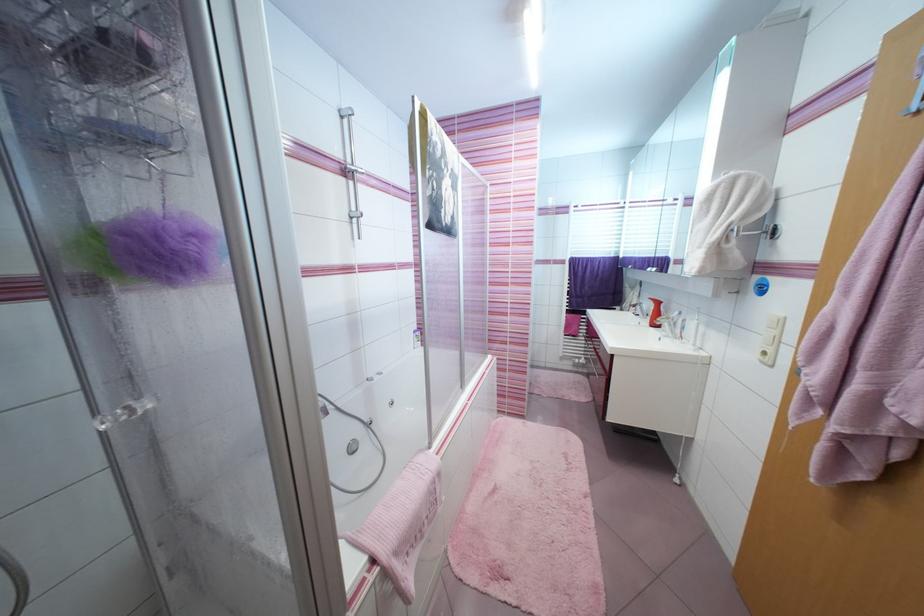
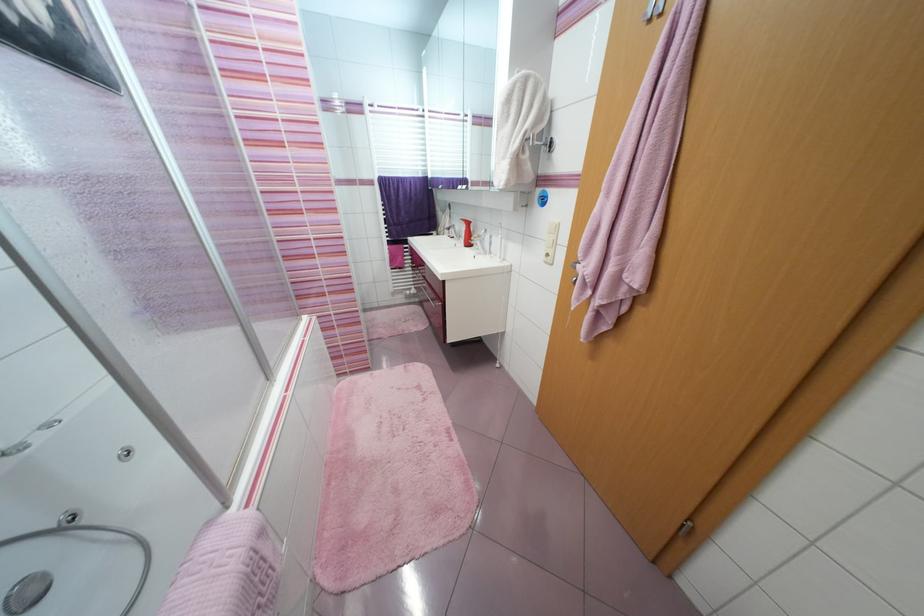
Locate, in the second image, the point that corresponds to (614,354) in the first image.

(445, 281)